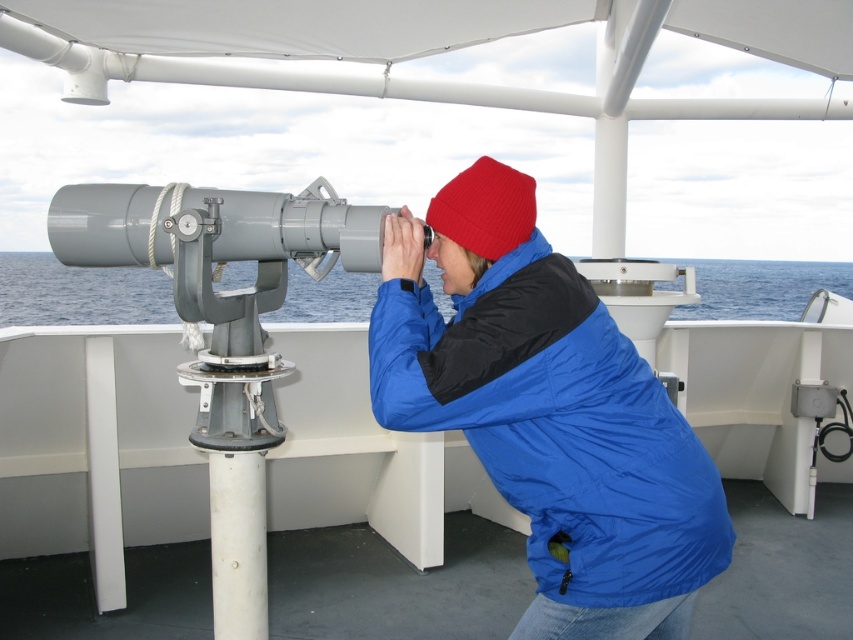
You are a photographer on the boat deck and want to take a photo of the blue synthetic jacket at center and the red knit beanie at center. Which object should you adjust your camera focus to first if you want to capture both in the same frame without moving the camera?

The red knit beanie at center is to the left of the blue synthetic jacket at center, so you should focus on the red knit beanie at center first as it is closer to the left side of the frame to ensure both are in focus.

You are a sailor on the boat deck and want to check the horizon through the telescope. When you look through the telescope, will the red knit beanie at center block your view of the blue water at center?

The red knit beanie at center is behind the blue water at center, so it will not block your view of the blue water at center when looking through the telescope.

You are standing on the deck of a boat and see a point at coordinates point (579, 388). If you want to move to the telescope mounted on the white pole, which is 4.85 feet away from the point, can you reach it within 3 steps?

The distance between the point (579, 388) and the telescope is 4.85 feet. Assuming an average step length of about 2.5 feet, 3 steps would cover approximately 7.5 feet, which is more than enough to reach the telescope. Therefore, you can reach the telescope within 3 steps.